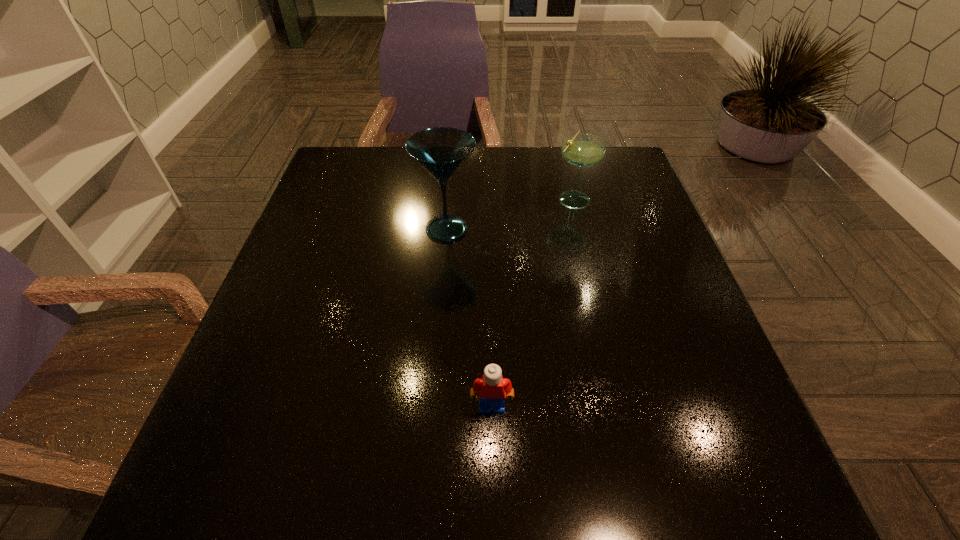
Locate an element on the screen. the left martini is located at coordinates (440, 150).

At what (x,y) coordinates should I click in order to perform the action: click on the taller martini. Please return your answer as a coordinate pair (x, y). Looking at the image, I should click on (440, 150).

In order to click on the right martini in this screenshot , I will do `click(583, 150)`.

The image size is (960, 540). I want to click on the second tallest object, so click(x=583, y=150).

At what (x,y) coordinates should I click in order to perform the action: click on Lego. Please return your answer as a coordinate pair (x, y). The height and width of the screenshot is (540, 960). Looking at the image, I should click on (492, 388).

The image size is (960, 540). Find the location of `the shortest object`. the shortest object is located at coordinates (492, 388).

Locate an element on the screen. This screenshot has height=540, width=960. blank space located on the right of the left martini is located at coordinates (522, 229).

Where is `blank space located on the front of the right martini`? The height and width of the screenshot is (540, 960). blank space located on the front of the right martini is located at coordinates (581, 228).

This screenshot has width=960, height=540. I want to click on vacant space located 0.150m on the face of the nearest object, so click(x=493, y=511).

The height and width of the screenshot is (540, 960). I want to click on object that is at the far edge, so click(x=583, y=150).